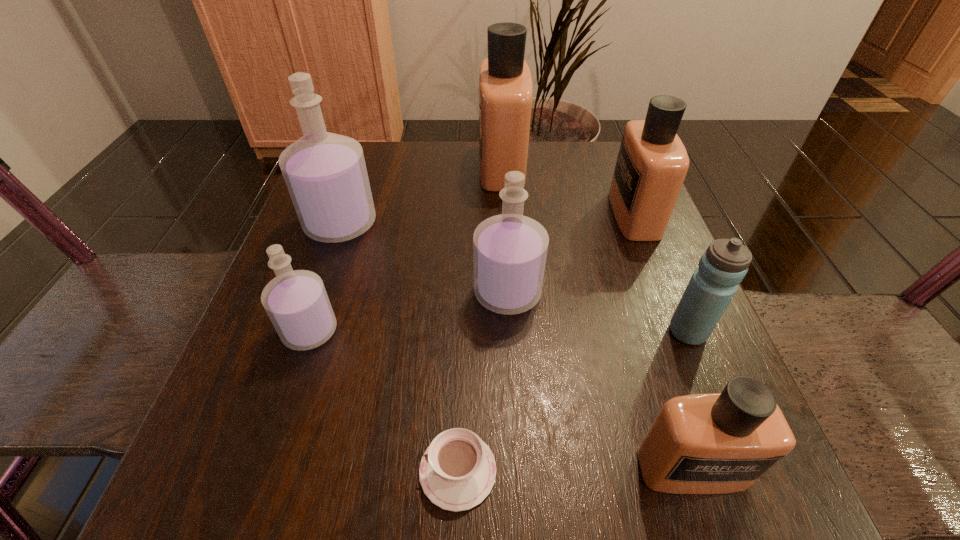
You are a GUI agent. You are given a task and a screenshot of the screen. Output one action in this format:
    pyautogui.click(x=<x>, y=<y>)
    Task: Click on the vacant space at the near left corner
    The width and height of the screenshot is (960, 540).
    Given the screenshot: What is the action you would take?
    pyautogui.click(x=235, y=502)

Find the location of a particular element. vacant space at the far right corner is located at coordinates (597, 174).

Where is `empty location between the biggest beige perfume and the nearest beige perfume`? empty location between the biggest beige perfume and the nearest beige perfume is located at coordinates (596, 316).

You are a GUI agent. You are given a task and a screenshot of the screen. Output one action in this format:
    pyautogui.click(x=<x>, y=<y>)
    Task: Click on the free spot between the farthest purple perfume and the leftmost beige perfume
    
    Given the screenshot: What is the action you would take?
    pyautogui.click(x=421, y=195)

You are a GUI agent. You are given a task and a screenshot of the screen. Output one action in this format:
    pyautogui.click(x=<x>, y=<y>)
    Task: Click on the vacant area that lies between the rightmost purple perfume and the shortest object
    The image size is (960, 540).
    Given the screenshot: What is the action you would take?
    pyautogui.click(x=483, y=382)

You are a GUI agent. You are given a task and a screenshot of the screen. Output one action in this format:
    pyautogui.click(x=<x>, y=<y>)
    Task: Click on the unoccupied position between the smallest purple perfume and the second smallest beige perfume
    Image resolution: width=960 pixels, height=540 pixels.
    Given the screenshot: What is the action you would take?
    pyautogui.click(x=472, y=273)

Where is `free space between the second biggest purple perfume and the farthest purple perfume`? free space between the second biggest purple perfume and the farthest purple perfume is located at coordinates (424, 259).

Find the location of `vacant point located between the second smallest beige perfume and the biggest beige perfume`. vacant point located between the second smallest beige perfume and the biggest beige perfume is located at coordinates [568, 190].

Where is `vacant area between the shortest object and the smallest purple perfume`? The width and height of the screenshot is (960, 540). vacant area between the shortest object and the smallest purple perfume is located at coordinates (384, 401).

The width and height of the screenshot is (960, 540). In order to click on free point between the biggest purple perfume and the biggest beige perfume in this screenshot , I will do `click(421, 195)`.